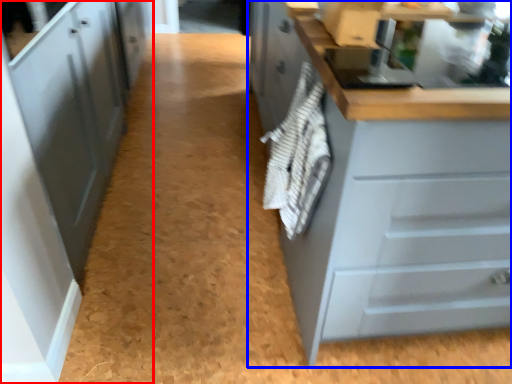
Question: Which point is further to the camera, cabinetry (highlighted by a red box) or cabinetry (highlighted by a blue box)?

Choices:
 (A) cabinetry
 (B) cabinetry

Answer: (A)